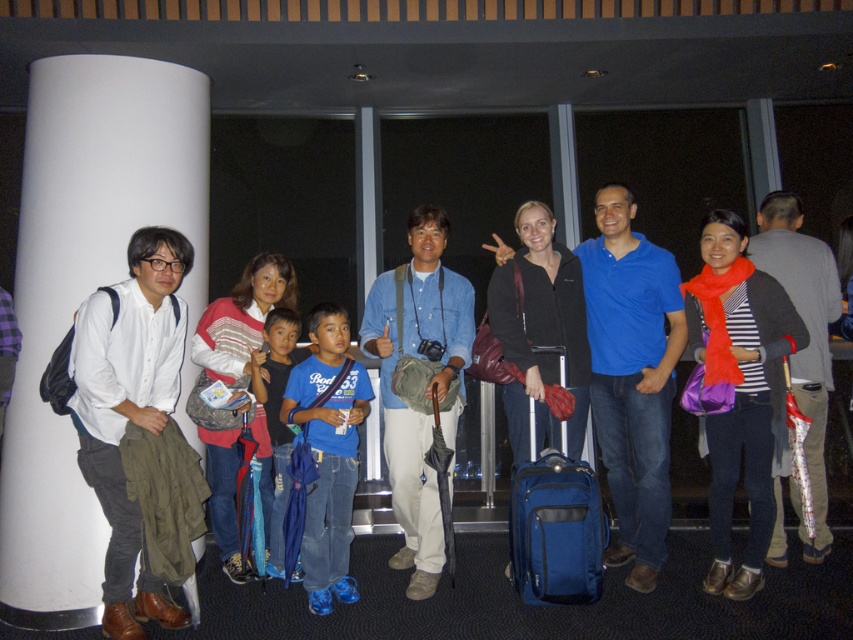
Is matte blue suitcase at center positioned at the back of blue denim jeans at center?

No, it is in front of blue denim jeans at center.

Who is more forward, (625,592) or (347,369)?

Positioned in front is point (625,592).

Does point (486, 531) lie in front of point (334, 308)?

No, (486, 531) is further to viewer.

Find the location of a particular element. matte blue suitcase at center is located at coordinates (535, 605).

Is matte blue suitcase at center positioned before blue fabric suitcase at center?

Yes, it is.

Is matte blue suitcase at center wider than blue fabric suitcase at center?

Correct, the width of matte blue suitcase at center exceeds that of blue fabric suitcase at center.

Between point (695, 563) and point (553, 568), which one is positioned behind?

Point (695, 563)

What are the coordinates of `matte blue suitcase at center` in the screenshot? It's located at (535, 605).

Does point (312, 355) come closer to viewer compared to point (512, 573)?

No.

Can you confirm if blue denim jeans at center is taller than blue fabric suitcase at center?

Yes.

Is point (357, 392) farther from viewer compared to point (553, 529)?

Yes, it is.

Where is `blue denim jeans at center`? The height and width of the screenshot is (640, 853). blue denim jeans at center is located at coordinates (328, 452).